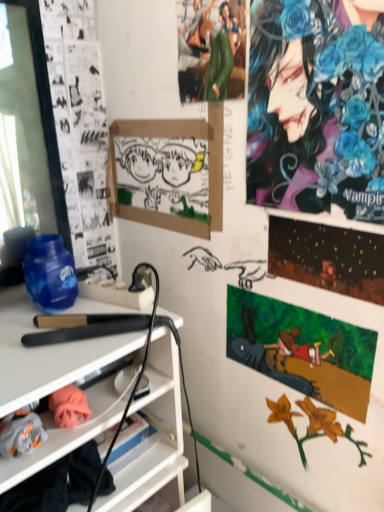
Describe the element at coordinates (169, 172) in the screenshot. This screenshot has width=384, height=512. I see `white paper drawing at center` at that location.

How much space does green fabric figure at upper center, the 1th person when ordered from left to right, occupy horizontally?

It is 0.99 inches.

What do you see at coordinates (211, 49) in the screenshot?
I see `green fabric figure at upper center, marked as the 2th person in a right-to-left arrangement` at bounding box center [211, 49].

The height and width of the screenshot is (512, 384). What do you see at coordinates (327, 257) in the screenshot?
I see `shiny metallic poster at upper right, which is the 2th poster page in bottom-to-top order` at bounding box center [327, 257].

This screenshot has height=512, width=384. Find the location of `white paper drawing at center`. white paper drawing at center is located at coordinates (169, 172).

In the scene shown: Is watercolor paper painting at upper right, arranged as the second poster page when viewed from the top, oriented away from shiny metallic poster at upper right, the 1th poster page positioned from the top?

No, watercolor paper painting at upper right, arranged as the second poster page when viewed from the top,'s orientation is not away from shiny metallic poster at upper right, the 1th poster page positioned from the top.

Considering the positions of objects watercolor paper painting at upper right, arranged as the second poster page when viewed from the top, and shiny metallic poster at upper right, which is the 2th poster page in bottom-to-top order, in the image provided, who is behind, watercolor paper painting at upper right, arranged as the second poster page when viewed from the top, or shiny metallic poster at upper right, which is the 2th poster page in bottom-to-top order,?

watercolor paper painting at upper right, arranged as the second poster page when viewed from the top, is further from the camera.

Can you tell me how much watercolor paper painting at upper right, which appears as the first poster page when ordered from the bottom, and shiny metallic poster at upper right, the 1th poster page positioned from the top, differ in facing direction?

There is a 0.18-degree angle between the facing directions of watercolor paper painting at upper right, which appears as the first poster page when ordered from the bottom, and shiny metallic poster at upper right, the 1th poster page positioned from the top.

Which of these two, watercolor paper painting at upper right, arranged as the second poster page when viewed from the top, or shiny metallic poster at upper right, which is the 2th poster page in bottom-to-top order, is bigger?

Bigger between the two is watercolor paper painting at upper right, arranged as the second poster page when viewed from the top.

Based on the photo, can you confirm if green fabric figure at upper center, the 1th person when ordered from left to right, is smaller than black matte hair straightener at center left?

Incorrect, green fabric figure at upper center, the 1th person when ordered from left to right, is not smaller in size than black matte hair straightener at center left.

Who is more distant, green fabric figure at upper center, the 1th person when ordered from left to right, or black matte hair straightener at center left?

green fabric figure at upper center, the 1th person when ordered from left to right, is more distant.

You are a GUI agent. You are given a task and a screenshot of the screen. Output one action in this format:
    pyautogui.click(x=<x>, y=<y>)
    Task: Click on the person that is the 1st object to the right of the black matte hair straightener at center left, starting at the anchor
    
    Given the screenshot: What is the action you would take?
    pyautogui.click(x=211, y=49)

Which is more to the right, green fabric figure at upper center, marked as the 2th person in a right-to-left arrangement, or black matte hair straightener at center left?

green fabric figure at upper center, marked as the 2th person in a right-to-left arrangement, is more to the right.

There is a white paper drawing at center. Identify the location of the 1st poster page below it (from the image's perspective). The width and height of the screenshot is (384, 512). (327, 257).

Considering the sizes of shiny metallic poster at upper right, which is the 2th poster page in bottom-to-top order, and white paper drawing at center in the image, is shiny metallic poster at upper right, which is the 2th poster page in bottom-to-top order, taller or shorter than white paper drawing at center?

Clearly, shiny metallic poster at upper right, which is the 2th poster page in bottom-to-top order, is shorter compared to white paper drawing at center.

Is shiny metallic poster at upper right, the 1th poster page positioned from the top, next to white paper drawing at center and touching it?

No, shiny metallic poster at upper right, the 1th poster page positioned from the top, is not beside white paper drawing at center.

From the image's perspective, is shiny metallic poster at upper right, the 1th poster page positioned from the top, located beneath white paper drawing at center?

Indeed, from the image's perspective, shiny metallic poster at upper right, the 1th poster page positioned from the top, is shown beneath white paper drawing at center.

Do you think black matte hair straightener at center left is within shiny metallic poster at upper right, which is the 2th poster page in bottom-to-top order, or outside of it?

black matte hair straightener at center left lies outside shiny metallic poster at upper right, which is the 2th poster page in bottom-to-top order.

This screenshot has height=512, width=384. In order to click on poster page in front of the black matte hair straightener at center left in this screenshot , I will do `click(327, 257)`.

Looking at the image, does black matte hair straightener at center left seem bigger or smaller compared to shiny metallic poster at upper right, which is the 2th poster page in bottom-to-top order?

In the image, black matte hair straightener at center left appears to be larger than shiny metallic poster at upper right, which is the 2th poster page in bottom-to-top order.

Is white paper drawing at center facing towards green fabric figure at upper center, the 1th person when ordered from left to right?

No, white paper drawing at center does not turn towards green fabric figure at upper center, the 1th person when ordered from left to right.

Who is shorter, white paper drawing at center or green fabric figure at upper center, marked as the 2th person in a right-to-left arrangement?

With less height is white paper drawing at center.

From a real-world perspective, who is located higher, white paper drawing at center or green fabric figure at upper center, marked as the 2th person in a right-to-left arrangement?

green fabric figure at upper center, marked as the 2th person in a right-to-left arrangement, is physically above.

Which object is wider, white paper drawing at center or green fabric figure at upper center, marked as the 2th person in a right-to-left arrangement?

Wider between the two is green fabric figure at upper center, marked as the 2th person in a right-to-left arrangement.

How many degrees apart are the facing directions of black matte hair straightener at center left and shiny blue flowers at upper right, the first person from the right?

The angle between the facing direction of black matte hair straightener at center left and the facing direction of shiny blue flowers at upper right, the first person from the right, is 47.6 degrees.

Considering the sizes of objects black matte hair straightener at center left and shiny blue flowers at upper right, the first person from the right, in the image provided, who is smaller, black matte hair straightener at center left or shiny blue flowers at upper right, the first person from the right,?

With smaller size is black matte hair straightener at center left.

From a real-world perspective, is black matte hair straightener at center left on top of shiny blue flowers at upper right, which appears as the 2th person when viewed from the left?

No, from a real-world perspective, black matte hair straightener at center left is not over shiny blue flowers at upper right, which appears as the 2th person when viewed from the left

Is black matte hair straightener at center left facing towards shiny blue flowers at upper right, which appears as the 2th person when viewed from the left?

No, black matte hair straightener at center left is not facing towards shiny blue flowers at upper right, which appears as the 2th person when viewed from the left.

Considering their positions, is black matte hair straightener at center left located in front of or behind white paper drawing at center?

Clearly, black matte hair straightener at center left is in front of white paper drawing at center.

Measure the distance from black matte hair straightener at center left to white paper drawing at center.

black matte hair straightener at center left is 39.75 centimeters away from white paper drawing at center.

Considering the sizes of black matte hair straightener at center left and white paper drawing at center in the image, is black matte hair straightener at center left wider or thinner than white paper drawing at center?

In the image, black matte hair straightener at center left appears to be wider than white paper drawing at center.

From a real-world perspective, does black matte hair straightener at center left sit lower than white paper drawing at center?

Yes.

Locate an element on the screen. poster page on the left of shiny metallic poster at upper right, the 1th poster page positioned from the top is located at coordinates (302, 350).

The image size is (384, 512). I want to click on the 2nd person located above the black matte hair straightener at center left (from a real-world perspective), so click(211, 49).

Considering their positions, is shiny blue flowers at upper right, the first person from the right, positioned closer to black matte hair straightener at center left than shiny metallic poster at upper right, the 1th poster page positioned from the top?

The object closer to black matte hair straightener at center left is shiny metallic poster at upper right, the 1th poster page positioned from the top.

Considering their positions, is white paper drawing at center positioned further to watercolor paper painting at upper right, arranged as the second poster page when viewed from the top, than shiny blue flowers at upper right, which appears as the 2th person when viewed from the left?

shiny blue flowers at upper right, which appears as the 2th person when viewed from the left, lies further to watercolor paper painting at upper right, arranged as the second poster page when viewed from the top, than the other object.

Based on the photo, when comparing their distances from black matte hair straightener at center left, does white paper drawing at center or watercolor paper painting at upper right, arranged as the second poster page when viewed from the top, seem closer?

watercolor paper painting at upper right, arranged as the second poster page when viewed from the top, lies closer to black matte hair straightener at center left than the other object.

Based on their spatial positions, is green fabric figure at upper center, the 1th person when ordered from left to right, or shiny blue flowers at upper right, the first person from the right, further from shiny metallic poster at upper right, which is the 2th poster page in bottom-to-top order?

green fabric figure at upper center, the 1th person when ordered from left to right.

Based on their spatial positions, is white paper drawing at center or shiny metallic poster at upper right, which is the 2th poster page in bottom-to-top order, further from green fabric figure at upper center, the 1th person when ordered from left to right?

shiny metallic poster at upper right, which is the 2th poster page in bottom-to-top order, lies further to green fabric figure at upper center, the 1th person when ordered from left to right, than the other object.

Considering their positions, is watercolor paper painting at upper right, arranged as the second poster page when viewed from the top, positioned closer to black matte hair straightener at center left than shiny metallic poster at upper right, which is the 2th poster page in bottom-to-top order?

The object closer to black matte hair straightener at center left is watercolor paper painting at upper right, arranged as the second poster page when viewed from the top.

Which object lies further to the anchor point green fabric figure at upper center, the 1th person when ordered from left to right, shiny metallic poster at upper right, the 1th poster page positioned from the top, or white paper drawing at center?

shiny metallic poster at upper right, the 1th poster page positioned from the top, is further to green fabric figure at upper center, the 1th person when ordered from left to right.

Which object lies further to the anchor point shiny blue flowers at upper right, which appears as the 2th person when viewed from the left, black matte hair straightener at center left or shiny metallic poster at upper right, which is the 2th poster page in bottom-to-top order?

Based on the image, black matte hair straightener at center left appears to be further to shiny blue flowers at upper right, which appears as the 2th person when viewed from the left.

This screenshot has width=384, height=512. In order to click on bulletin board situated between black matte hair straightener at center left and shiny metallic poster at upper right, which is the 2th poster page in bottom-to-top order, from left to right in this screenshot , I will do `click(169, 172)`.

Identify the location of person between green fabric figure at upper center, marked as the 2th person in a right-to-left arrangement, and shiny metallic poster at upper right, which is the 2th poster page in bottom-to-top order, vertically. This screenshot has height=512, width=384. (316, 106).

Where is `equipment between green fabric figure at upper center, marked as the 2th person in a right-to-left arrangement, and watercolor paper painting at upper right, arranged as the second poster page when viewed from the top, from top to bottom`? Image resolution: width=384 pixels, height=512 pixels. equipment between green fabric figure at upper center, marked as the 2th person in a right-to-left arrangement, and watercolor paper painting at upper right, arranged as the second poster page when viewed from the top, from top to bottom is located at coordinates (84, 327).

The width and height of the screenshot is (384, 512). Find the location of `bulletin board between shiny blue flowers at upper right, the first person from the right, and watercolor paper painting at upper right, which appears as the first poster page when ordered from the bottom, in the vertical direction`. bulletin board between shiny blue flowers at upper right, the first person from the right, and watercolor paper painting at upper right, which appears as the first poster page when ordered from the bottom, in the vertical direction is located at coordinates (169, 172).